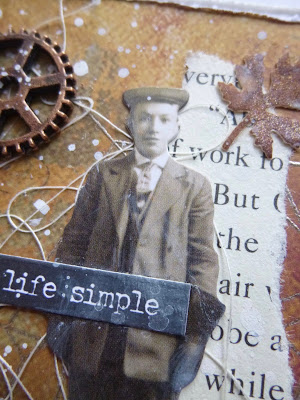
The width and height of the screenshot is (300, 400). Find the location of `little black sign that reads "life simple"`. little black sign that reads "life simple" is located at coordinates (35, 283), (104, 288).